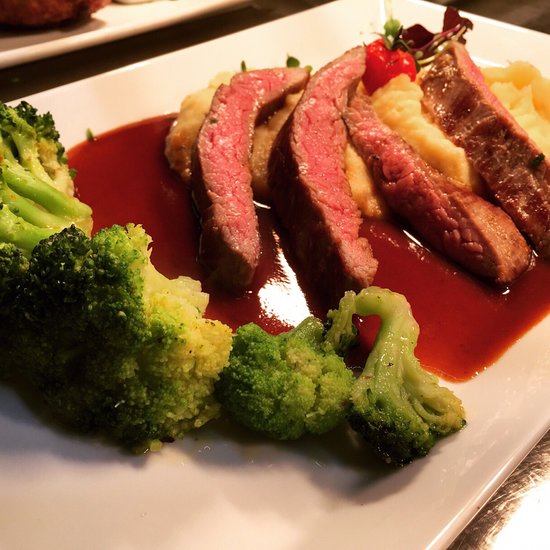
Where is `plate`? plate is located at coordinates (353, 520), (143, 495), (525, 400), (338, 11), (154, 15), (497, 47).